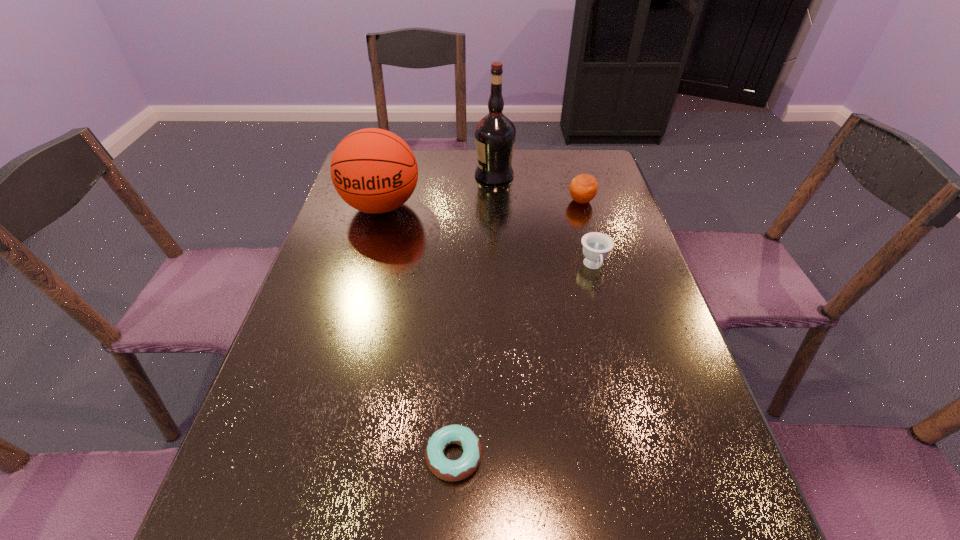
Locate an element on the screen. Image resolution: width=960 pixels, height=540 pixels. the tallest object is located at coordinates (495, 134).

Where is `the second tallest object`? The height and width of the screenshot is (540, 960). the second tallest object is located at coordinates (373, 170).

What are the coordinates of `basketball` in the screenshot? It's located at (373, 170).

Image resolution: width=960 pixels, height=540 pixels. Find the location of `orange`. orange is located at coordinates (583, 188).

The height and width of the screenshot is (540, 960). Find the location of `the fourth farthest object`. the fourth farthest object is located at coordinates (596, 246).

I want to click on the fourth tallest object, so click(x=596, y=246).

Image resolution: width=960 pixels, height=540 pixels. In order to click on the shortest object in this screenshot , I will do `click(449, 470)`.

Find the location of a particular element. doughnut is located at coordinates (449, 470).

The width and height of the screenshot is (960, 540). I want to click on vacant space located 0.130m on the surface of the liquor, so click(x=436, y=175).

Where is `vacant area located on the surface of the liquor`? The image size is (960, 540). vacant area located on the surface of the liquor is located at coordinates (357, 175).